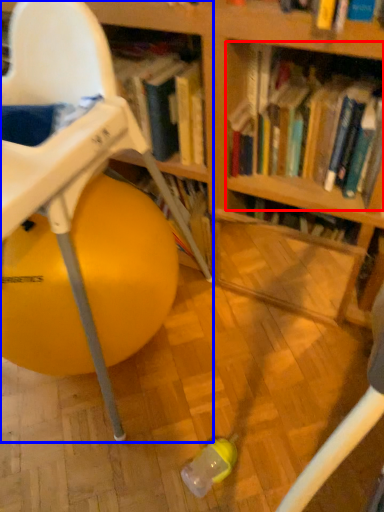
Question: Which point is closer to the camera, book (highlighted by a red box) or chair (highlighted by a blue box)?

Choices:
 (A) book
 (B) chair

Answer: (B)